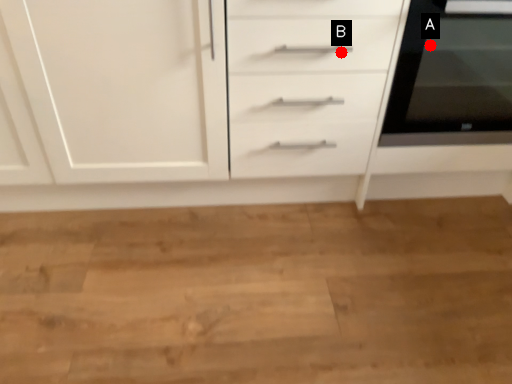
Question: Two points are circled on the image, labeled by A and B beside each circle. Which point appears closest to the camera in this image?

Choices:
 (A) A is closer
 (B) B is closer

Answer: (A)